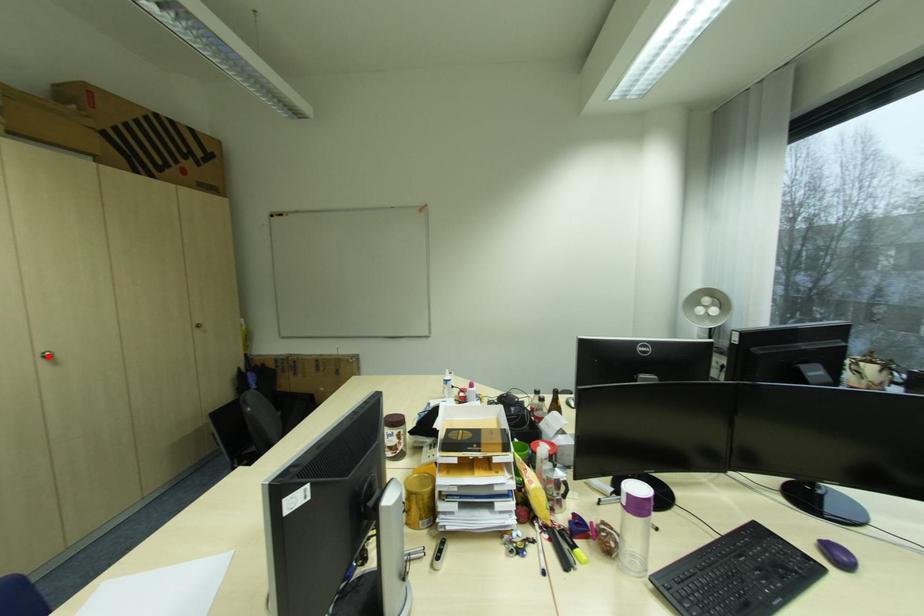
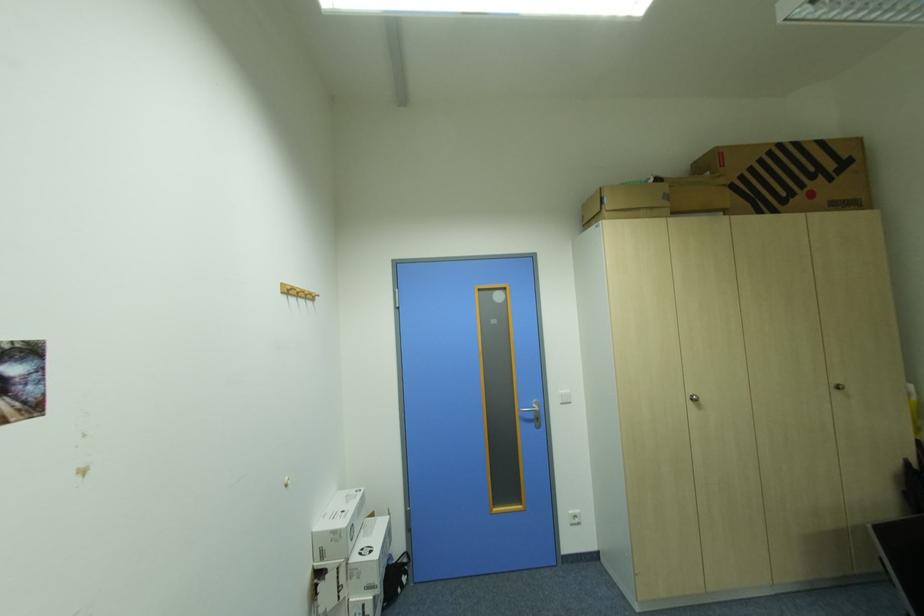
Question: I am providing you with two images of the same scene from different viewpoints. A red point is marked on the first image. Is the red point's position out of view in image 2?

Choices:
 (A) Yes
 (B) No

Answer: (B)